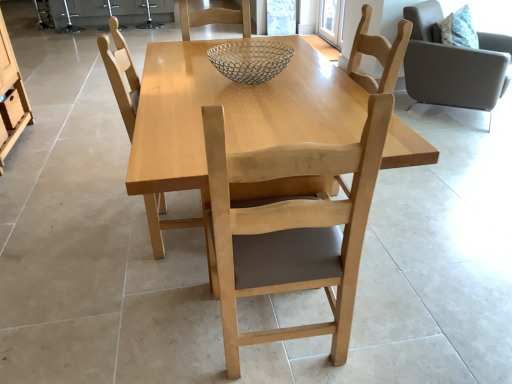
Question: From the image's perspective, is light brown wood chair at right, placed as the 3th chair when sorted from left to right, below matte wood drawer at left?

Choices:
 (A) no
 (B) yes

Answer: (A)

Question: Could you tell me if light brown wood chair at right, which is the 3th chair in front-to-back order, is turned towards matte wood drawer at left?

Choices:
 (A) yes
 (B) no

Answer: (B)

Question: Is light brown wood chair at right, which is the 3th chair in front-to-back order, in front of matte wood drawer at left?

Choices:
 (A) no
 (B) yes

Answer: (B)

Question: Is light brown wood chair at right, which is the first chair in right-to-left order, taller than matte wood drawer at left?

Choices:
 (A) no
 (B) yes

Answer: (B)

Question: Is light brown wood chair at right, which appears as the first chair when viewed from the back, placed right next to matte wood drawer at left?

Choices:
 (A) no
 (B) yes

Answer: (A)

Question: From a real-world perspective, is light brown wood chair at right, placed as the 3th chair when sorted from left to right, located higher than matte wood drawer at left?

Choices:
 (A) no
 (B) yes

Answer: (B)

Question: Is light wood chair at center, placed as the 3th chair when sorted from back to front, looking in the opposite direction of metallic wire mesh bowl at center?

Choices:
 (A) no
 (B) yes

Answer: (A)

Question: Can you confirm if light wood chair at center, which is the second chair in right-to-left order, is smaller than metallic wire mesh bowl at center?

Choices:
 (A) yes
 (B) no

Answer: (B)

Question: Does light wood chair at center, which is the second chair in right-to-left order, have a greater height compared to metallic wire mesh bowl at center?

Choices:
 (A) yes
 (B) no

Answer: (A)

Question: From a real-world perspective, is light wood chair at center, which is the second chair in right-to-left order, positioned over metallic wire mesh bowl at center based on gravity?

Choices:
 (A) no
 (B) yes

Answer: (A)

Question: Is light wood chair at center, the 2th chair when ordered from left to right, not near metallic wire mesh bowl at center?

Choices:
 (A) no
 (B) yes

Answer: (A)

Question: Does light wood chair at center, placed as the 3th chair when sorted from back to front, lie in front of metallic wire mesh bowl at center?

Choices:
 (A) yes
 (B) no

Answer: (A)

Question: From a real-world perspective, is matte wood drawer at left located higher than light wood table at center?

Choices:
 (A) yes
 (B) no

Answer: (B)